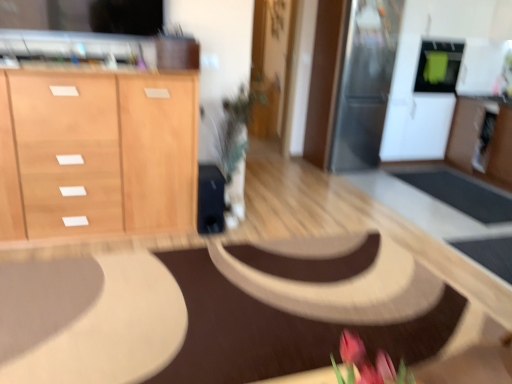
What do you see at coordinates (364, 83) in the screenshot?
I see `sleek stainless steel refrigerator at upper right, the 1th appliance viewed from the left` at bounding box center [364, 83].

The image size is (512, 384). What do you see at coordinates (438, 65) in the screenshot?
I see `green matte microwave at upper right, arranged as the 1th appliance when viewed from the right` at bounding box center [438, 65].

What do you see at coordinates (100, 152) in the screenshot?
I see `light wood cabinet at left` at bounding box center [100, 152].

The height and width of the screenshot is (384, 512). Find the location of `sleek stainless steel refrigerator at upper right, which is the second appliance in right-to-left order`. sleek stainless steel refrigerator at upper right, which is the second appliance in right-to-left order is located at coordinates (364, 83).

From the image's perspective, is brown fabric mat at center over light wood cabinet at left?

No, from the image's perspective, brown fabric mat at center is not on top of light wood cabinet at left.

From a real-world perspective, is brown fabric mat at center on top of light wood cabinet at left?

No, from a real-world perspective, brown fabric mat at center is not over light wood cabinet at left

Would you say brown fabric mat at center is inside or outside light wood cabinet at left?

brown fabric mat at center is spatially situated outside light wood cabinet at left.

Is brown fabric mat at center wider than sleek stainless steel refrigerator at upper right, which is the second appliance in right-to-left order?

Correct, the width of brown fabric mat at center exceeds that of sleek stainless steel refrigerator at upper right, which is the second appliance in right-to-left order.

Looking at the image, does brown fabric mat at center seem bigger or smaller compared to sleek stainless steel refrigerator at upper right, the 1th appliance viewed from the left?

In the image, brown fabric mat at center appears to be smaller than sleek stainless steel refrigerator at upper right, the 1th appliance viewed from the left.

Which is closer, (397,339) or (385,83)?

Point (397,339) is positioned closer to the camera compared to point (385,83).

Looking at this image, would you say sleek stainless steel refrigerator at upper right, which is the second appliance in right-to-left order, is part of brown fabric mat at center's contents?

No.

Is sleek stainless steel refrigerator at upper right, which is the second appliance in right-to-left order, positioned with its back to green matte microwave at upper right, arranged as the 1th appliance when viewed from the right?

sleek stainless steel refrigerator at upper right, which is the second appliance in right-to-left order, is not turned away from green matte microwave at upper right, arranged as the 1th appliance when viewed from the right.

Is sleek stainless steel refrigerator at upper right, which is the second appliance in right-to-left order, far from green matte microwave at upper right, arranged as the 1th appliance when viewed from the right?

No.

Is sleek stainless steel refrigerator at upper right, the 1th appliance viewed from the left, wider than green matte microwave at upper right, arranged as the 1th appliance when viewed from the right?

Yes, sleek stainless steel refrigerator at upper right, the 1th appliance viewed from the left, is wider than green matte microwave at upper right, arranged as the 1th appliance when viewed from the right.

Considering the relative positions of sleek stainless steel refrigerator at upper right, which is the second appliance in right-to-left order, and green matte microwave at upper right, the 2th appliance positioned from the left, in the image provided, is sleek stainless steel refrigerator at upper right, which is the second appliance in right-to-left order, to the left of green matte microwave at upper right, the 2th appliance positioned from the left, from the viewer's perspective?

Yes.

From the image's perspective, is light wood cabinet at left positioned above or below sleek stainless steel refrigerator at upper right, the 1th appliance viewed from the left?

light wood cabinet at left is situated lower than sleek stainless steel refrigerator at upper right, the 1th appliance viewed from the left, in the image.

Can you see light wood cabinet at left touching sleek stainless steel refrigerator at upper right, the 1th appliance viewed from the left?

No.

Is sleek stainless steel refrigerator at upper right, the 1th appliance viewed from the left, at the back of light wood cabinet at left?

No, light wood cabinet at left's orientation is not away from sleek stainless steel refrigerator at upper right, the 1th appliance viewed from the left.

Consider the image. Who is bigger, light wood cabinet at left or sleek stainless steel refrigerator at upper right, the 1th appliance viewed from the left?

With larger size is light wood cabinet at left.

Is point (222, 311) closer to viewer compared to point (426, 55)?

Yes, it is in front of point (426, 55).

Is brown fabric mat at center wider than green matte microwave at upper right, arranged as the 1th appliance when viewed from the right?

Yes, brown fabric mat at center is wider than green matte microwave at upper right, arranged as the 1th appliance when viewed from the right.

Between brown fabric mat at center and green matte microwave at upper right, the 2th appliance positioned from the left, which one has larger size?

brown fabric mat at center is bigger.

Is the depth of light wood cabinet at left greater than that of brown fabric mat at center?

Yes, light wood cabinet at left is further from the camera.

Does light wood cabinet at left appear on the left side of brown fabric mat at center?

Correct, you'll find light wood cabinet at left to the left of brown fabric mat at center.

Considering the relative sizes of light wood cabinet at left and brown fabric mat at center in the image provided, is light wood cabinet at left shorter than brown fabric mat at center?

No.

The width and height of the screenshot is (512, 384). I want to click on cabinetry located on the left of green matte microwave at upper right, the 2th appliance positioned from the left, so click(100, 152).

Which point is more distant from viewer, (x=143, y=132) or (x=458, y=67)?

The point (x=458, y=67) is behind.

Does light wood cabinet at left appear on the right side of green matte microwave at upper right, the 2th appliance positioned from the left?

In fact, light wood cabinet at left is to the left of green matte microwave at upper right, the 2th appliance positioned from the left.

I want to click on mat below the light wood cabinet at left (from a real-world perspective), so click(x=277, y=331).

I want to click on mat that is below the sleek stainless steel refrigerator at upper right, which is the second appliance in right-to-left order (from the image's perspective), so click(277, 331).

When comparing their distances from green matte microwave at upper right, arranged as the 1th appliance when viewed from the right, does brown fabric mat at center or sleek stainless steel refrigerator at upper right, which is the second appliance in right-to-left order, seem closer?

sleek stainless steel refrigerator at upper right, which is the second appliance in right-to-left order.

From the image, which object appears to be farther from light wood cabinet at left, green matte microwave at upper right, the 2th appliance positioned from the left, or brown fabric mat at center?

Among the two, green matte microwave at upper right, the 2th appliance positioned from the left, is located further to light wood cabinet at left.

Based on their spatial positions, is sleek stainless steel refrigerator at upper right, the 1th appliance viewed from the left, or light wood cabinet at left closer to green matte microwave at upper right, the 2th appliance positioned from the left?

sleek stainless steel refrigerator at upper right, the 1th appliance viewed from the left, lies closer to green matte microwave at upper right, the 2th appliance positioned from the left, than the other object.

Looking at the image, which one is located further to green matte microwave at upper right, arranged as the 1th appliance when viewed from the right, light wood cabinet at left or brown fabric mat at center?

light wood cabinet at left is positioned further to the anchor green matte microwave at upper right, arranged as the 1th appliance when viewed from the right.

From the image, which object appears to be farther from light wood cabinet at left, sleek stainless steel refrigerator at upper right, which is the second appliance in right-to-left order, or brown fabric mat at center?

sleek stainless steel refrigerator at upper right, which is the second appliance in right-to-left order, lies further to light wood cabinet at left than the other object.

Based on their spatial positions, is brown fabric mat at center or green matte microwave at upper right, the 2th appliance positioned from the left, further from light wood cabinet at left?

The object further to light wood cabinet at left is green matte microwave at upper right, the 2th appliance positioned from the left.

Estimate the real-world distances between objects in this image. Which object is closer to sleek stainless steel refrigerator at upper right, which is the second appliance in right-to-left order, light wood cabinet at left or brown fabric mat at center?

brown fabric mat at center is closer to sleek stainless steel refrigerator at upper right, which is the second appliance in right-to-left order.

When comparing their distances from sleek stainless steel refrigerator at upper right, the 1th appliance viewed from the left, does light wood cabinet at left or green matte microwave at upper right, arranged as the 1th appliance when viewed from the right, seem closer?

Among the two, green matte microwave at upper right, arranged as the 1th appliance when viewed from the right, is located nearer to sleek stainless steel refrigerator at upper right, the 1th appliance viewed from the left.

Find the location of a particular element. appliance between brown fabric mat at center and green matte microwave at upper right, the 2th appliance positioned from the left, in the front-back direction is located at coordinates (364, 83).

Identify the location of appliance between light wood cabinet at left and green matte microwave at upper right, the 2th appliance positioned from the left, from left to right. (364, 83).

Where is `cabinetry between brown fabric mat at center and sleek stainless steel refrigerator at upper right, the 1th appliance viewed from the left, in the front-back direction`? cabinetry between brown fabric mat at center and sleek stainless steel refrigerator at upper right, the 1th appliance viewed from the left, in the front-back direction is located at coordinates (100, 152).

I want to click on cabinetry positioned between brown fabric mat at center and green matte microwave at upper right, arranged as the 1th appliance when viewed from the right, from near to far, so click(100, 152).